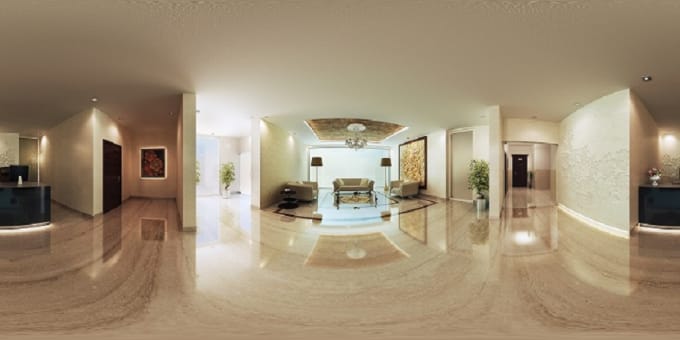
Locate an element on the screen. The width and height of the screenshot is (680, 340). black door on left side is located at coordinates (109, 173).